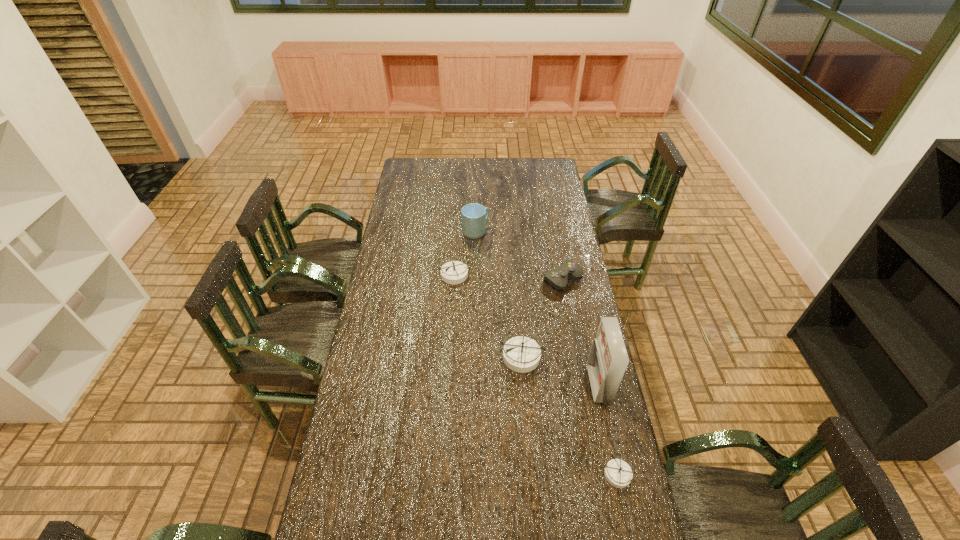
I want to click on free space located 0.060m on the back of the farthest compass, so click(456, 254).

You are a GUI agent. You are given a task and a screenshot of the screen. Output one action in this format:
    pyautogui.click(x=<x>, y=<y>)
    Task: Click on the free spot located 0.280m on the left of the second compass from right to left
    This screenshot has width=960, height=540.
    Given the screenshot: What is the action you would take?
    pyautogui.click(x=425, y=356)

Locate an element on the screen. free spot located 0.170m on the left of the shortest object is located at coordinates (547, 474).

What are the coordinates of `free region located 0.140m on the back of the farthest object` in the screenshot? It's located at (476, 207).

Where is `vacant space located 0.180m on the back of the control`? This screenshot has width=960, height=540. vacant space located 0.180m on the back of the control is located at coordinates (556, 241).

Where is `vacant region located 0.140m on the front-facing side of the tallest object`? vacant region located 0.140m on the front-facing side of the tallest object is located at coordinates (551, 385).

The height and width of the screenshot is (540, 960). I want to click on free location located 0.210m on the front-facing side of the tallest object, so click(x=531, y=385).

Where is `vacant point located 0.140m on the front-facing side of the tallest object`? The image size is (960, 540). vacant point located 0.140m on the front-facing side of the tallest object is located at coordinates (551, 385).

Identify the location of compass that is at the right edge. (618, 473).

The image size is (960, 540). Find the location of `control located in the right edge section of the desktop`. control located in the right edge section of the desktop is located at coordinates (558, 278).